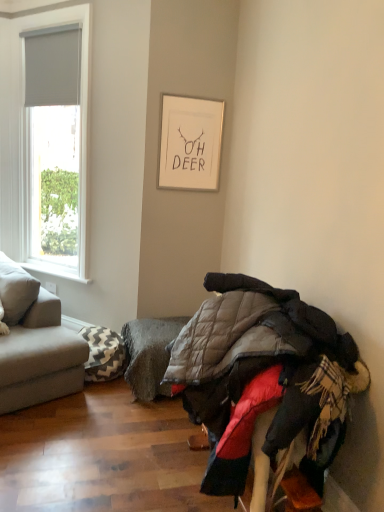
Identify the location of free point above gray fabric blind at upper left (from a real-world perspective). This screenshot has height=512, width=384. (48, 27).